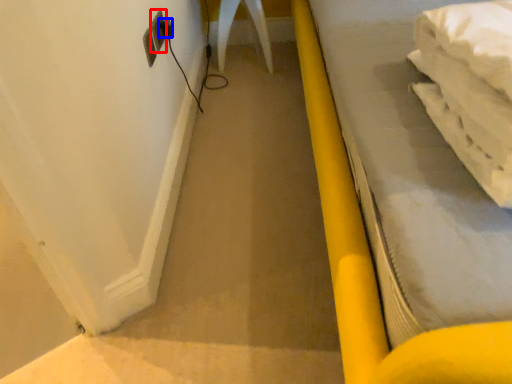
Question: Which point is further to the camera, electric outlet (highlighted by a red box) or plug (highlighted by a blue box)?

Choices:
 (A) electric outlet
 (B) plug

Answer: (B)